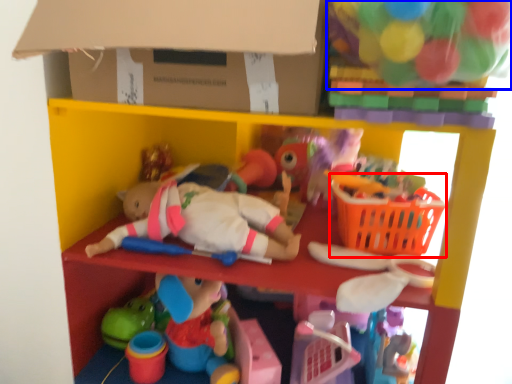
Question: Which object appears closest to the camera in this image, basket (highlighted by a red box) or toy (highlighted by a blue box)?

Choices:
 (A) basket
 (B) toy

Answer: (B)